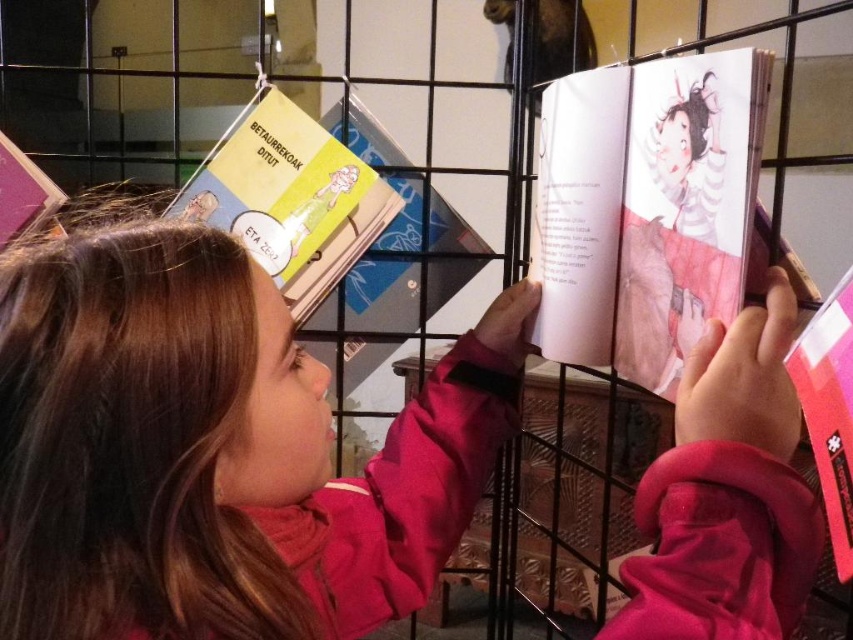
Does hardcover book at center have a lesser width compared to pink matte book at upper right?

In fact, hardcover book at center might be wider than pink matte book at upper right.

Who is more forward, (347, 97) or (848, 529)?

Positioned in front is point (848, 529).

The image size is (853, 640). Identify the location of hardcover book at center. (390, 259).

Is hardcover book at center positioned at the back of matte yellow book at upper left?

Yes.

Who is more forward, (363,140) or (32,193)?

Point (32,193)

The image size is (853, 640). Find the location of `hardcover book at center`. hardcover book at center is located at coordinates (390, 259).

What do you see at coordinates (645, 209) in the screenshot?
I see `matte pink paper book at center` at bounding box center [645, 209].

Is point (587, 333) positioned behind point (310, 262)?

That is False.

Locate an element on the screen. matte pink paper book at center is located at coordinates (645, 209).